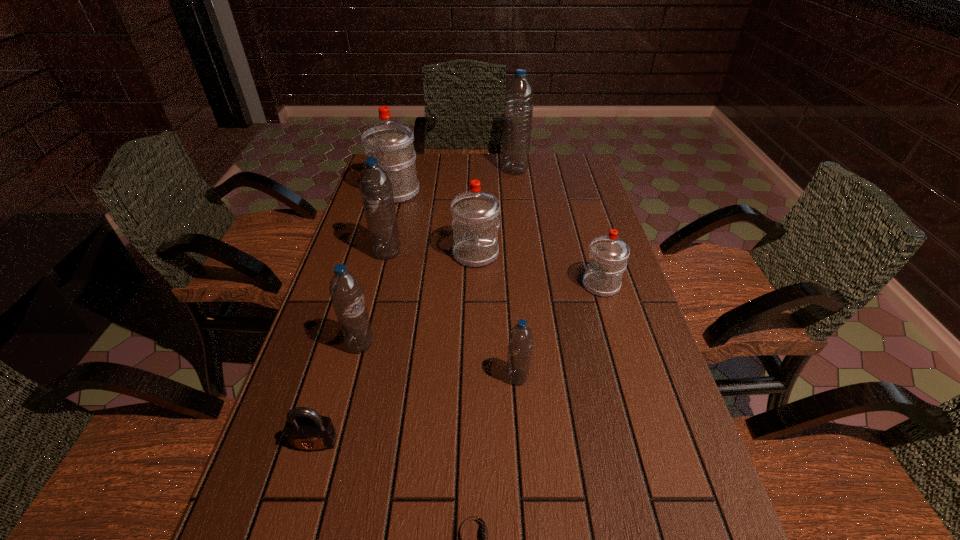
Identify the location of the farthest water bottle. This screenshot has width=960, height=540. (518, 108).

In order to click on the biggest blue water bottle in this screenshot , I will do `click(518, 108)`.

The image size is (960, 540). I want to click on the leftmost white water bottle, so click(x=392, y=142).

Image resolution: width=960 pixels, height=540 pixels. Identify the location of the farthest white water bottle. (392, 142).

Image resolution: width=960 pixels, height=540 pixels. In order to click on the third nearest blue water bottle in this screenshot , I will do `click(376, 189)`.

Locate an element on the screen. the second smallest blue water bottle is located at coordinates (345, 290).

Identify the location of the second nearest blue water bottle. (345, 290).

Image resolution: width=960 pixels, height=540 pixels. I want to click on the fourth water bottle from left to right, so coord(475,222).

In order to click on the second nearest white water bottle in this screenshot , I will do `click(475, 222)`.

At what (x,y) coordinates should I click in order to perform the action: click on the nearest water bottle. Please return your answer as a coordinate pair (x, y). The height and width of the screenshot is (540, 960). Looking at the image, I should click on (520, 342).